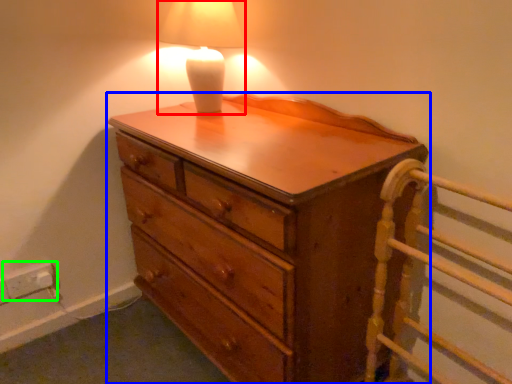
Question: Considering the real-world distances, which object is closest to lamp (highlighted by a red box)? chest of drawers (highlighted by a blue box) or electric outlet (highlighted by a green box).

Choices:
 (A) chest of drawers
 (B) electric outlet

Answer: (A)